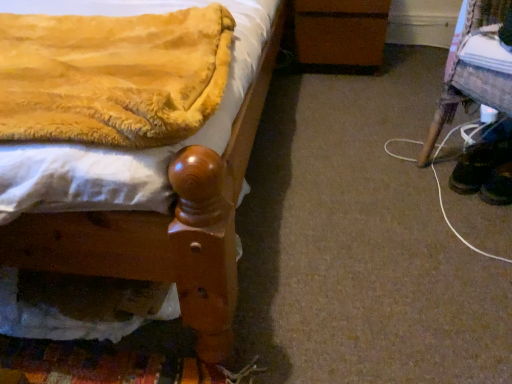
I want to click on vacant area that lies between wooden stool at lower right and black leather shoes at lower right, acting as the 2th footwear starting from the right, so click(442, 189).